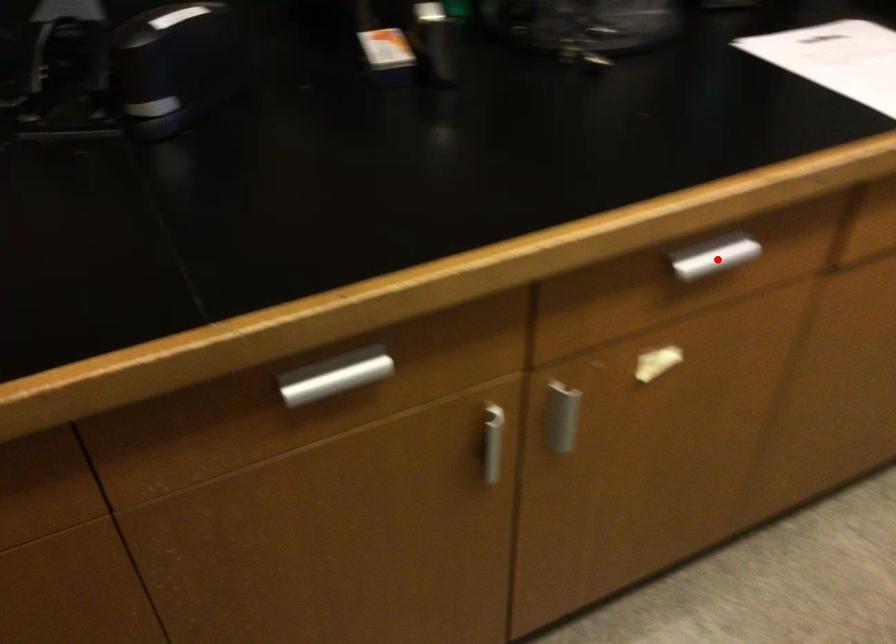
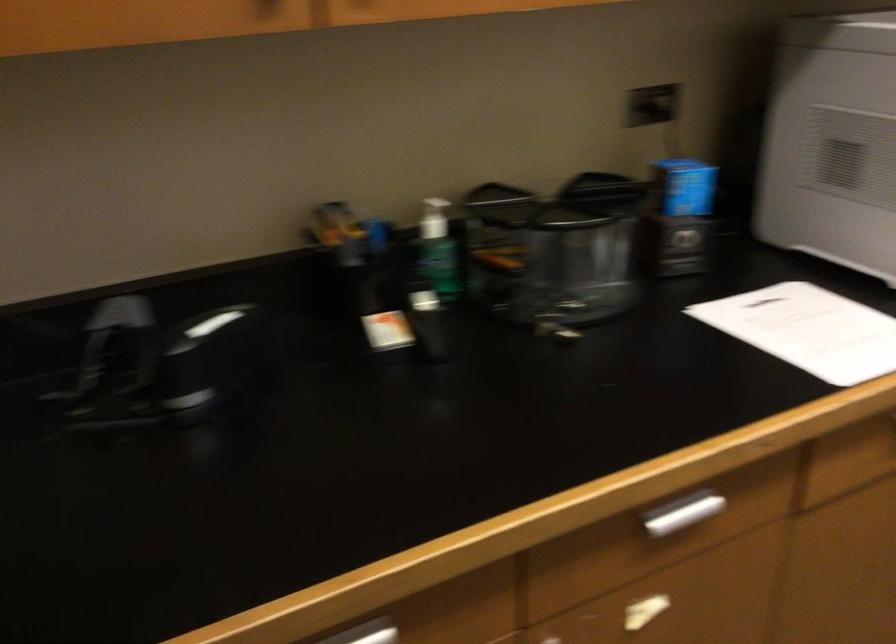
Where in the second image is the point corresponding to the highlighted location from the first image?

(686, 514)